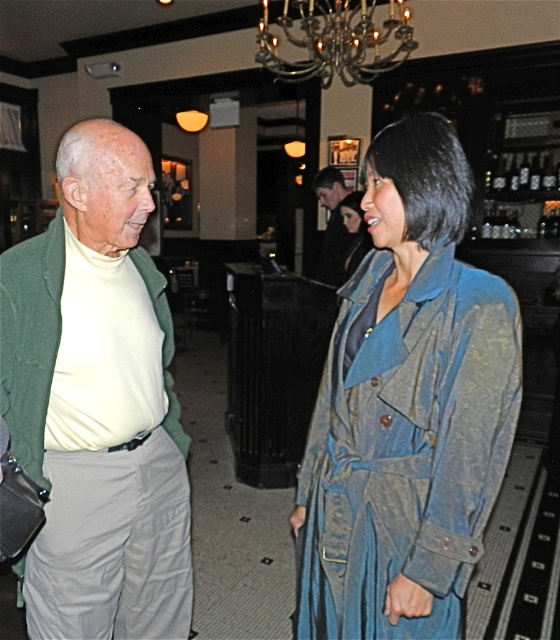
Can you confirm if blue denim trench coat at center is smaller than green wool sweater at left?

Actually, blue denim trench coat at center might be larger than green wool sweater at left.

Between point (367, 284) and point (87, 291), which one is positioned behind?

Point (87, 291)

Between point (476, 305) and point (102, 282), which one is positioned in front?

Positioned in front is point (476, 305).

This screenshot has height=640, width=560. Identify the location of blue denim trench coat at center. (407, 406).

Can you confirm if silver metallic chandelier at upper center is positioned to the left of smooth black hair at upper center?

In fact, silver metallic chandelier at upper center is to the right of smooth black hair at upper center.

Is point (297, 74) farther from viewer compared to point (329, 216)?

Yes, it is behind point (329, 216).

Which is in front, point (403, 52) or point (334, 241)?

Positioned in front is point (334, 241).

Locate an element on the screen. The image size is (560, 640). silver metallic chandelier at upper center is located at coordinates (336, 38).

Is point (416, 160) behind point (333, 177)?

No, (416, 160) is in front of (333, 177).

Which is more to the left, blue denim trench coat at center or smooth black hair at upper center?

Positioned to the left is blue denim trench coat at center.

Between point (440, 305) and point (322, 195), which one is positioned behind?

The point (322, 195) is behind.

You are a GUI agent. You are given a task and a screenshot of the screen. Output one action in this format:
    pyautogui.click(x=<x>, y=<y>)
    Task: Click on the blue denim trench coat at center
    This screenshot has width=560, height=640.
    Given the screenshot: What is the action you would take?
    pyautogui.click(x=407, y=406)